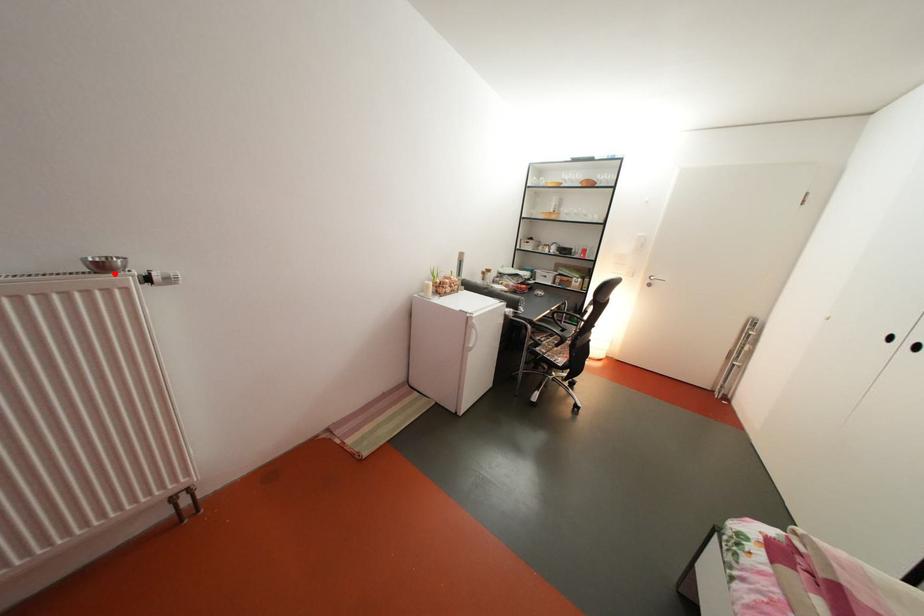
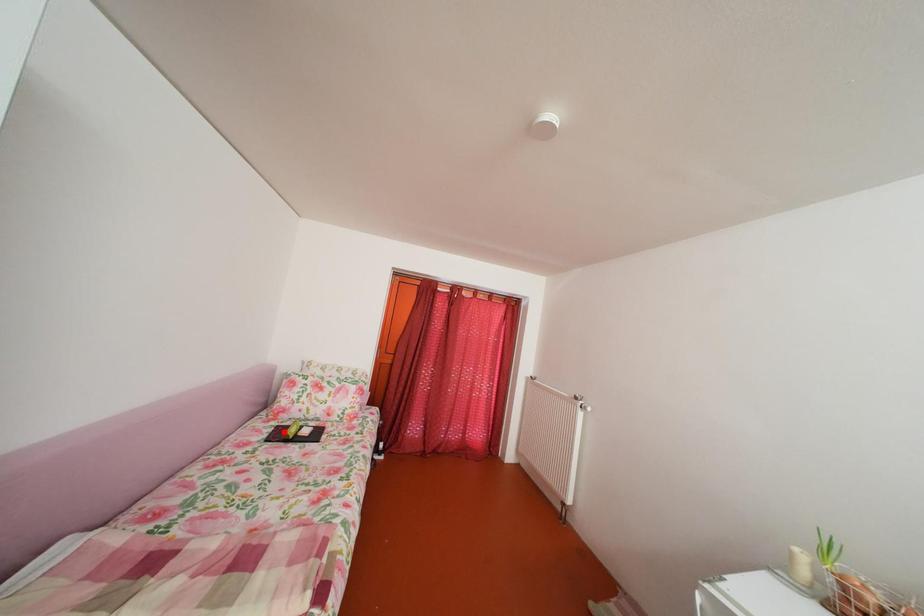
I am providing you with two images of the same scene from different viewpoints. A red point is marked on the first image and another point is marked on the second image. Is the marked point in image1 the same physical position as the marked point in image2?

No